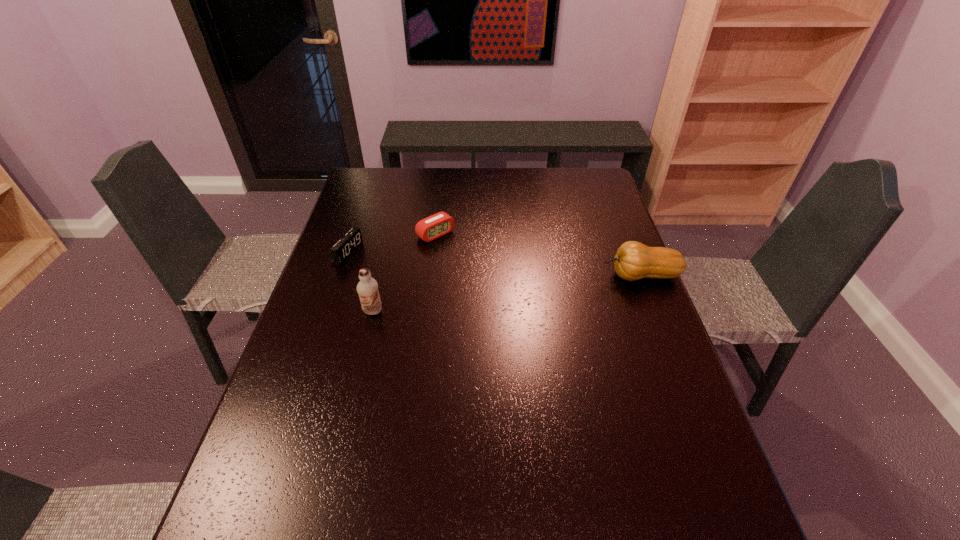
At what (x,y) coordinates should I click in order to perform the action: click on the third object from right to left. Please return your answer as a coordinate pair (x, y). This screenshot has height=540, width=960. Looking at the image, I should click on (367, 288).

This screenshot has width=960, height=540. In order to click on the nearest object in this screenshot , I will do `click(367, 288)`.

Image resolution: width=960 pixels, height=540 pixels. I want to click on the third shortest object, so pos(633,261).

In order to click on gourd in this screenshot , I will do `click(633, 261)`.

This screenshot has width=960, height=540. What are the coordinates of `the second object from right to left` in the screenshot? It's located at (428, 229).

This screenshot has width=960, height=540. Identify the location of the left alarm clock. (352, 240).

Where is `blank space located on the front of the third object from right to left`? blank space located on the front of the third object from right to left is located at coordinates (351, 402).

In order to click on free space located 0.070m on the stem side of the second tallest object in this screenshot , I will do `click(579, 275)`.

Locate an element on the screen. Image resolution: width=960 pixels, height=540 pixels. vacant point located on the stem side of the second tallest object is located at coordinates tap(484, 275).

This screenshot has width=960, height=540. I want to click on vacant space located on the stem side of the second tallest object, so click(515, 275).